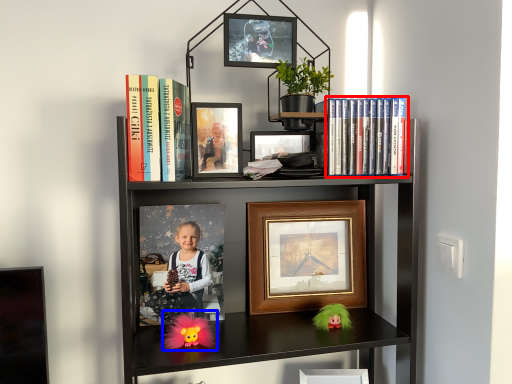
Question: Among these objects, which one is nearest to the camera, book (highlighted by a red box) or doll (highlighted by a blue box)?

Choices:
 (A) book
 (B) doll

Answer: (B)